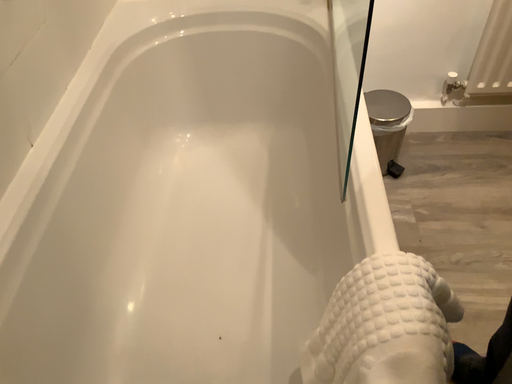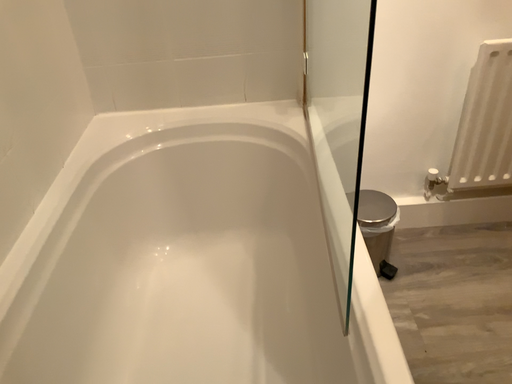
Question: Which way did the camera rotate in the video?

Choices:
 (A) rotated downward
 (B) rotated upward

Answer: (B)